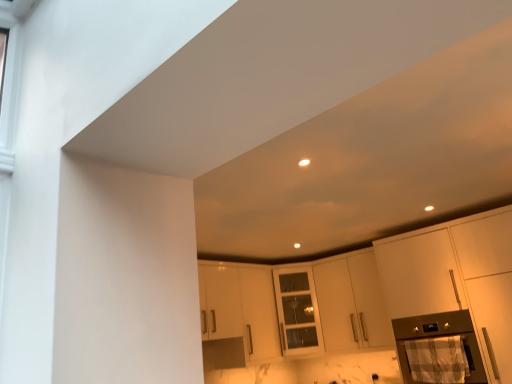
Question: In the image, is matte white cabinet at right, arranged as the 1th cabinetry when viewed from the front, on the left side or the right side of white matte cabinet at center, the first cabinetry in the back-to-front sequence?

Choices:
 (A) left
 (B) right

Answer: (B)

Question: Is matte white cabinet at right, arranged as the 1th cabinetry when viewed from the front, wider or thinner than white matte cabinet at center, the first cabinetry in the back-to-front sequence?

Choices:
 (A) wide
 (B) thin

Answer: (A)

Question: Estimate the real-world distances between objects in this image. Which object is farther from the metallic stainless steel oven at lower right?

Choices:
 (A) white matte cabinet at center, the first cabinetry in the back-to-front sequence
 (B) matte white cabinet at right, which is the second cabinetry in back-to-front order

Answer: (A)

Question: Estimate the real-world distances between objects in this image. Which object is closer to the white matte cabinet at center, positioned as the second cabinetry in front-to-back order?

Choices:
 (A) matte white cabinet at right, which is the second cabinetry in back-to-front order
 (B) metallic stainless steel oven at lower right

Answer: (B)